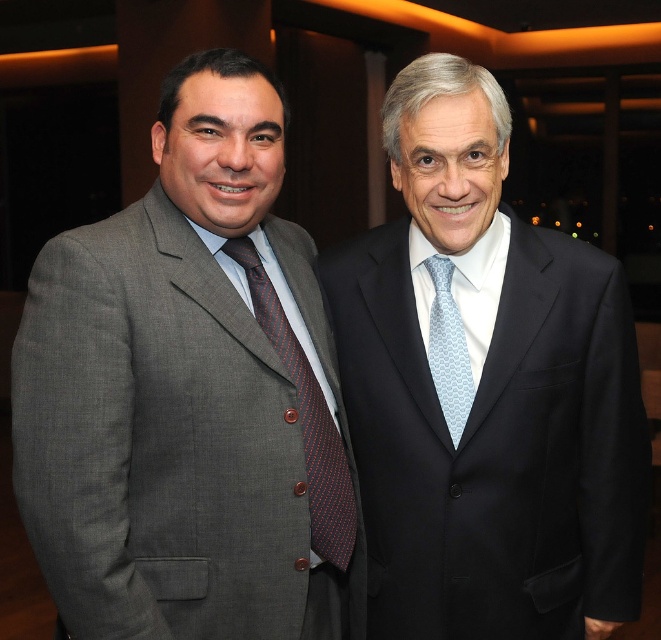
You are a photographer at a formal event. You need to capture a photo of the matte black suit at right and the light blue textured tie at center. Based on their positions, which object is located to the right of the other?

The matte black suit at right is to the right of the light blue textured tie at center.

You are a tailor who needs to determine which suit requires a longer hanger. Based on the image, which suit between the gray textured suit at left and the matte black suit at right should be hung on a taller hanger?

The gray textured suit at left has a greater height compared to the matte black suit at right, so it should be hung on a taller hanger.